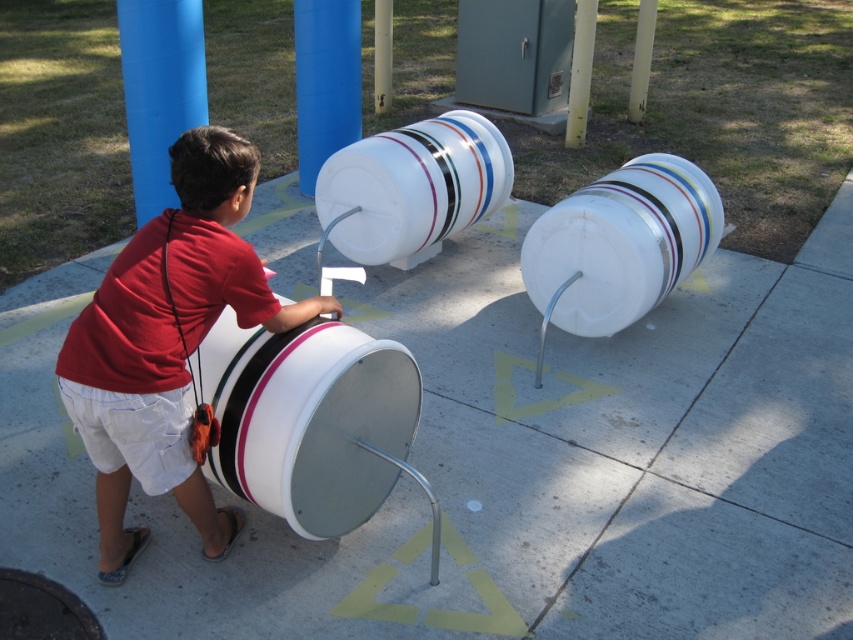
Between white concrete pavement at center and white plastic barrel at center, which one has more height?

Standing taller between the two is white concrete pavement at center.

Who is positioned more to the left, white concrete pavement at center or white plastic barrel at center?

Positioned to the left is white concrete pavement at center.

At what (x,y) coordinates should I click in order to perform the action: click on white concrete pavement at center. Please return your answer as a coordinate pair (x, y). Image resolution: width=853 pixels, height=640 pixels. Looking at the image, I should click on (511, 465).

Can you confirm if white glossy barrel at center is thinner than blue plastic pillar at upper center?

In fact, white glossy barrel at center might be wider than blue plastic pillar at upper center.

Which is below, white glossy barrel at center or blue plastic pillar at upper center?

white glossy barrel at center is below.

Who is more distant from viewer, (492, 170) or (306, 88)?

Point (306, 88)

Where is `white glossy barrel at center`? This screenshot has width=853, height=640. white glossy barrel at center is located at coordinates (412, 186).

Based on the photo, is white glossy drum at center above white plastic barrel at center?

No, white glossy drum at center is not above white plastic barrel at center.

This screenshot has height=640, width=853. I want to click on white glossy drum at center, so [x=308, y=419].

Between point (221, 330) and point (583, 188), which one is positioned in front?

Point (221, 330) is in front.

I want to click on white glossy drum at center, so click(308, 419).